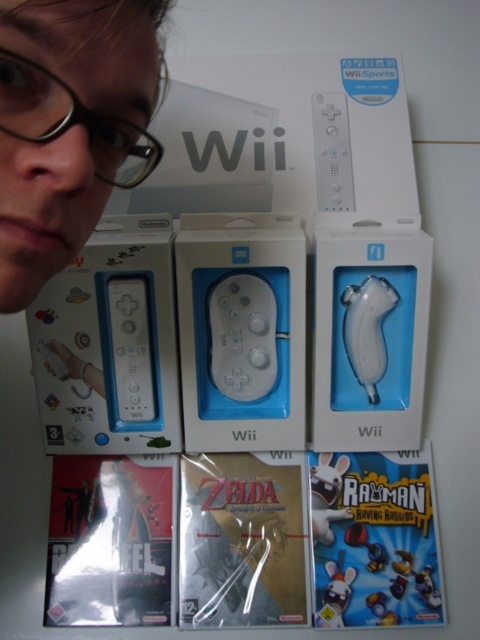
Between clear plastic glasses at upper left and white matte wii remote at center, which one appears on the left side from the viewer's perspective?

white matte wii remote at center

Can you confirm if clear plastic glasses at upper left is positioned to the left of white matte wii remote at center?

In fact, clear plastic glasses at upper left is to the right of white matte wii remote at center.

Describe the element at coordinates (72, 122) in the screenshot. I see `clear plastic glasses at upper left` at that location.

This screenshot has width=480, height=640. I want to click on clear plastic glasses at upper left, so click(x=72, y=122).

Between point (84, 109) and point (372, 333), which one is positioned in front?

Positioned in front is point (84, 109).

Does point (55, 122) come behind point (376, 321)?

That is False.

Where is `clear plastic glasses at upper left`? Image resolution: width=480 pixels, height=640 pixels. clear plastic glasses at upper left is located at coordinates (72, 122).

Can you confirm if white matte game controller at center is shorter than white matte wii remote at center?

Indeed, white matte game controller at center has a lesser height compared to white matte wii remote at center.

Is white matte game controller at center taller than white matte wii remote at center?

No.

This screenshot has width=480, height=640. Describe the element at coordinates (242, 337) in the screenshot. I see `white matte game controller at center` at that location.

Find the location of a particular element. This screenshot has height=640, width=480. white matte game controller at center is located at coordinates (242, 337).